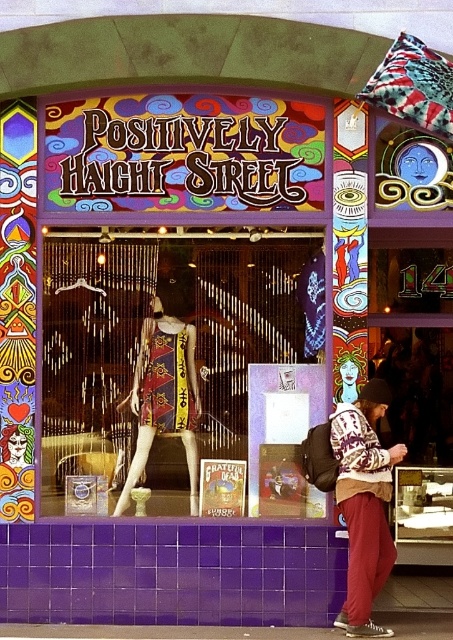
Question: Is textured fabric dress at center further to camera compared to knit sweater at center?

Choices:
 (A) no
 (B) yes

Answer: (B)

Question: Which point appears closest to the camera in this image?

Choices:
 (A) 131,486
 (B) 369,531
 (C) 256,253

Answer: (B)

Question: Among these objects, which one is farthest from the camera?

Choices:
 (A) printed fabric dress at center
 (B) knit sweater at center
 (C) textured fabric dress at center

Answer: (A)

Question: Is knit sweater at center above printed fabric dress at center?

Choices:
 (A) no
 (B) yes

Answer: (A)

Question: Which object is the farthest from the printed fabric dress at center?

Choices:
 (A) knit sweater at center
 (B) textured fabric dress at center

Answer: (A)

Question: Can you confirm if knit sweater at center is bigger than printed fabric dress at center?

Choices:
 (A) yes
 (B) no

Answer: (A)